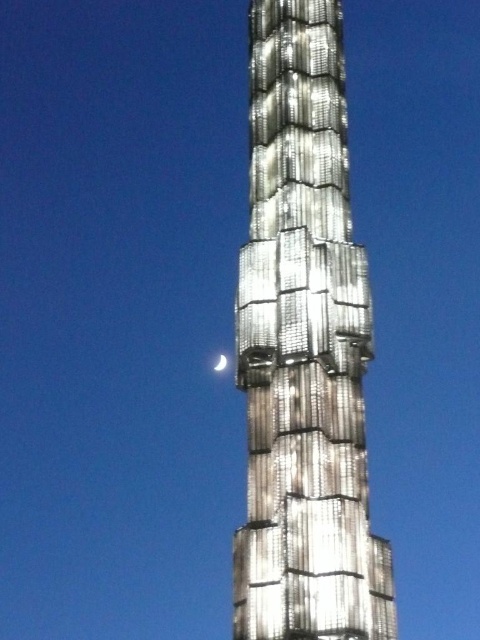
You are standing in front of the illuminated structure and want to locate the point at coordinates point (303, 349). Based on the description, which object is this point located on?

The point (303, 349) is located on the metallic silver tower at center.